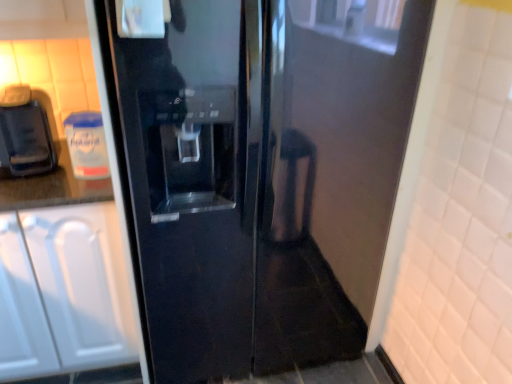
In order to face glossy black refrigerator at center, should I rotate leftwards or rightwards?

Turn right approximately 0.423 degrees to face it.

Describe the element at coordinates (26, 134) in the screenshot. This screenshot has height=384, width=512. I see `matte black coffee machine at left` at that location.

The image size is (512, 384). Find the location of `glossy black refrigerator at center`. glossy black refrigerator at center is located at coordinates (264, 185).

Which of these two, white matte cabinet at left or matte black coffee machine at left, is thinner?

With smaller width is matte black coffee machine at left.

Would you say white matte cabinet at left is inside or outside matte black coffee machine at left?

white matte cabinet at left is not enclosed by matte black coffee machine at left.

Is white matte cabinet at left taller than matte black coffee machine at left?

Indeed, white matte cabinet at left has a greater height compared to matte black coffee machine at left.

Which object is closer to the camera taking this photo, white matte cabinet at left or matte black coffee machine at left?

Positioned in front is white matte cabinet at left.

Can you confirm if glossy black refrigerator at center is shorter than white matte cabinet at left?

Incorrect, the height of glossy black refrigerator at center does not fall short of that of white matte cabinet at left.

Considering the sizes of objects glossy black refrigerator at center and white matte cabinet at left in the image provided, who is bigger, glossy black refrigerator at center or white matte cabinet at left?

glossy black refrigerator at center is bigger.

From the image's perspective, is glossy black refrigerator at center beneath white matte cabinet at left?

Incorrect, from the image's perspective, glossy black refrigerator at center is higher than white matte cabinet at left.

From a real-world perspective, which is physically below, glossy black refrigerator at center or white matte cabinet at left?

In real-world perspective, white matte cabinet at left is lower.

Between glossy black refrigerator at center and matte black coffee machine at left, which one has larger size?

glossy black refrigerator at center.

Does glossy black refrigerator at center have a greater width compared to matte black coffee machine at left?

Yes.

From the image's perspective, does glossy black refrigerator at center appear higher than matte black coffee machine at left?

Incorrect, from the image's perspective, glossy black refrigerator at center is lower than matte black coffee machine at left.

Can you tell me how much glossy black refrigerator at center and matte black coffee machine at left differ in facing direction?

2.61 degrees separate the facing orientations of glossy black refrigerator at center and matte black coffee machine at left.

Which is correct: matte black coffee machine at left is inside white matte cabinet at left, or outside of it?

The correct answer is: outside.

Is matte black coffee machine at left aimed at white matte cabinet at left?

No, matte black coffee machine at left is not facing towards white matte cabinet at left.

Which of these two, matte black coffee machine at left or white matte cabinet at left, is thinner?

With smaller width is matte black coffee machine at left.

Which of these two, matte black coffee machine at left or white matte cabinet at left, stands taller?

white matte cabinet at left.

Does white matte cabinet at left contain glossy black refrigerator at center?

No, white matte cabinet at left does not contain glossy black refrigerator at center.

Who is taller, white matte cabinet at left or glossy black refrigerator at center?

glossy black refrigerator at center is taller.

Which object is more forward, white matte cabinet at left or glossy black refrigerator at center?

glossy black refrigerator at center is more forward.

Considering the relative sizes of matte black coffee machine at left and glossy black refrigerator at center in the image provided, is matte black coffee machine at left wider than glossy black refrigerator at center?

Incorrect, the width of matte black coffee machine at left does not surpass that of glossy black refrigerator at center.

Is matte black coffee machine at left far away from glossy black refrigerator at center?

matte black coffee machine at left is actually quite close to glossy black refrigerator at center.

Is matte black coffee machine at left oriented away from glossy black refrigerator at center?

No, matte black coffee machine at left is not facing away from glossy black refrigerator at center.

Can you confirm if matte black coffee machine at left is shorter than glossy black refrigerator at center?

Indeed, matte black coffee machine at left has a lesser height compared to glossy black refrigerator at center.

The width and height of the screenshot is (512, 384). In the image, there is a matte black coffee machine at left. Find the location of `cabinetry below it (from the image's perspective)`. cabinetry below it (from the image's perspective) is located at coordinates (63, 292).

At what (x,y) coordinates should I click in order to perform the action: click on cabinetry lying on the left of glossy black refrigerator at center. Please return your answer as a coordinate pair (x, y). Looking at the image, I should click on (63, 292).

Estimate the real-world distances between objects in this image. Which object is further from glossy black refrigerator at center, white matte cabinet at left or matte black coffee machine at left?

matte black coffee machine at left.

Based on their spatial positions, is white matte cabinet at left or glossy black refrigerator at center further from matte black coffee machine at left?

Based on the image, glossy black refrigerator at center appears to be further to matte black coffee machine at left.

Estimate the real-world distances between objects in this image. Which object is further from white matte cabinet at left, matte black coffee machine at left or glossy black refrigerator at center?

Based on the image, glossy black refrigerator at center appears to be further to white matte cabinet at left.

Looking at the image, which one is located further to matte black coffee machine at left, glossy black refrigerator at center or white matte cabinet at left?

The object further to matte black coffee machine at left is glossy black refrigerator at center.

Based on the photo, which object lies further to the anchor point glossy black refrigerator at center, matte black coffee machine at left or white matte cabinet at left?

Among the two, matte black coffee machine at left is located further to glossy black refrigerator at center.

When comparing their distances from white matte cabinet at left, does glossy black refrigerator at center or matte black coffee machine at left seem further?

glossy black refrigerator at center.

Locate an element on the screen. coffee machine located between white matte cabinet at left and glossy black refrigerator at center in the left-right direction is located at coordinates (26, 134).